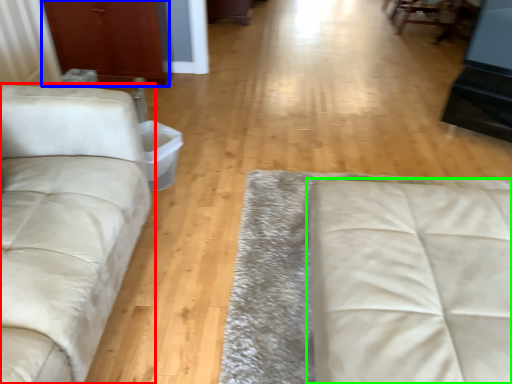
Question: Which is farther away from studio couch (highlighted by a red box)? armoire (highlighted by a blue box) or studio couch (highlighted by a green box)?

Choices:
 (A) armoire
 (B) studio couch

Answer: (A)